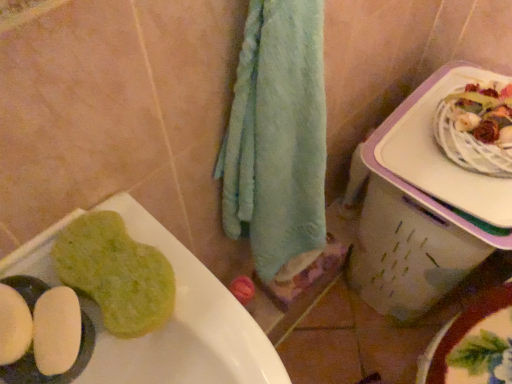
Question: Considering the positions of white plastic lunch box at right and green sponge at lower left in the image, is white plastic lunch box at right wider or thinner than green sponge at lower left?

Choices:
 (A) thin
 (B) wide

Answer: (B)

Question: Is white plastic lunch box at right in front of or behind green sponge at lower left in the image?

Choices:
 (A) behind
 (B) front

Answer: (A)

Question: Which of these objects is positioned farthest from the white plastic lunch box at right?

Choices:
 (A) green sponge at lower left
 (B) green sponge at lower left

Answer: (A)

Question: Estimate the real-world distances between objects in this image. Which object is closer to the white plastic lunch box at right?

Choices:
 (A) green sponge at lower left
 (B) green sponge at lower left

Answer: (A)